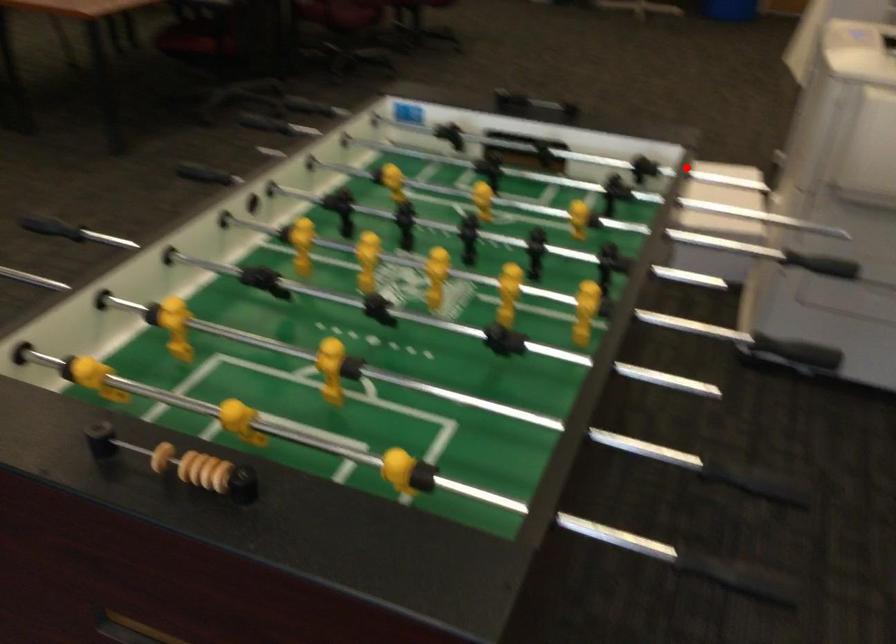
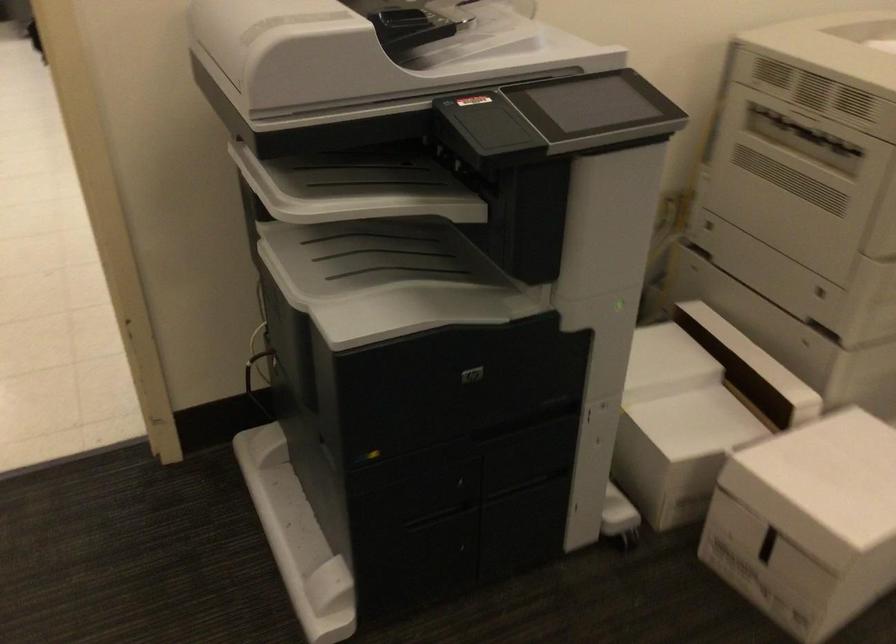
Find the pixel in the second image that matches the highlighted location in the first image.

(807, 522)